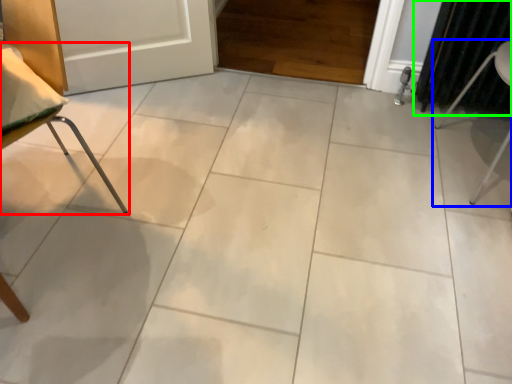
Question: Estimate the real-world distances between objects in this image. Which object is farther from furniture (highlighted by a red box), furniture (highlighted by a blue box) or curtain (highlighted by a green box)?

Choices:
 (A) furniture
 (B) curtain

Answer: (A)